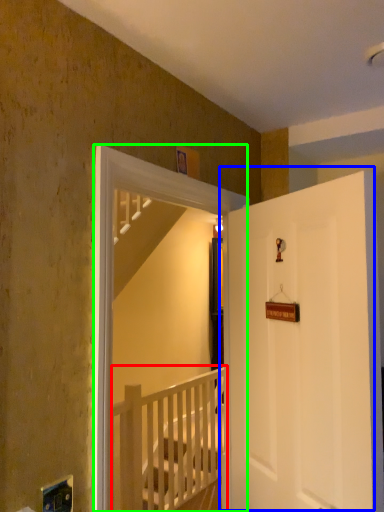
Question: Which object is positioned closest to rail (highlighted by a red box)? Select from door (highlighted by a blue box) and screen door (highlighted by a green box).

Choices:
 (A) door
 (B) screen door

Answer: (A)